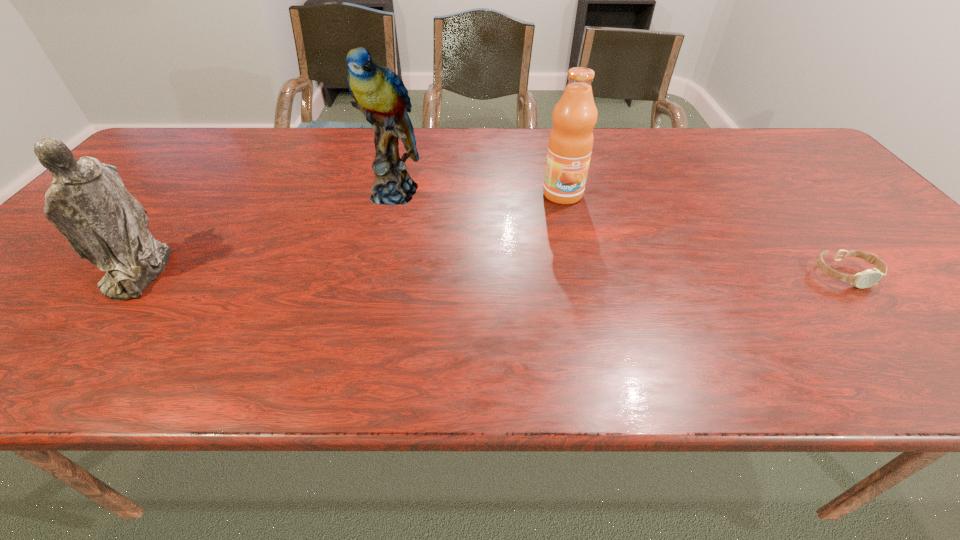
This screenshot has height=540, width=960. What are the coordinates of `vacant space located 0.180m on the face of the second object from left to right` in the screenshot? It's located at (388, 260).

Image resolution: width=960 pixels, height=540 pixels. Find the location of `blank space located on the face of the second object from left to right`. blank space located on the face of the second object from left to right is located at coordinates (386, 303).

The width and height of the screenshot is (960, 540). I want to click on free space located 0.370m on the face of the second object from left to right, so click(x=385, y=326).

At what (x,y) coordinates should I click in order to perform the action: click on vacant region located on the label side of the third object from left to right. Please return your answer as a coordinate pair (x, y). The height and width of the screenshot is (540, 960). Looking at the image, I should click on (588, 265).

The height and width of the screenshot is (540, 960). I want to click on vacant region located on the label side of the third object from left to right, so click(584, 249).

Find the location of a particular element. The height and width of the screenshot is (540, 960). free spot located on the label side of the third object from left to right is located at coordinates (581, 244).

Where is `object that is positioned at the near edge`? The height and width of the screenshot is (540, 960). object that is positioned at the near edge is located at coordinates (87, 202).

Identify the location of object that is at the right edge. The height and width of the screenshot is (540, 960). (870, 277).

What are the coordinates of `vacant space at the far edge of the desktop` in the screenshot? It's located at (467, 158).

At what (x,y) coordinates should I click in order to perform the action: click on free space at the near edge of the desktop. Please return your answer as a coordinate pair (x, y). Looking at the image, I should click on (158, 305).